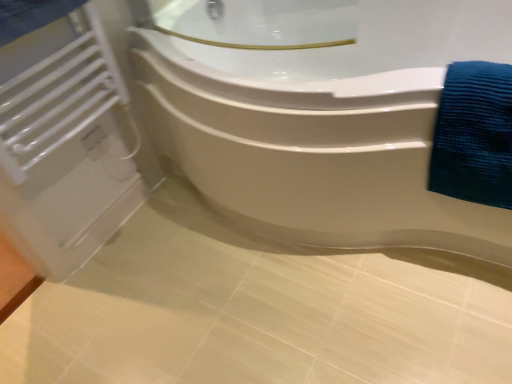
Question: Is white glossy bathtub at upper center looking in the opposite direction of white matte radiator at left?

Choices:
 (A) no
 (B) yes

Answer: (A)

Question: Considering the relative sizes of white glossy bathtub at upper center and white matte radiator at left in the image provided, is white glossy bathtub at upper center bigger than white matte radiator at left?

Choices:
 (A) no
 (B) yes

Answer: (B)

Question: Can you confirm if white glossy bathtub at upper center is thinner than white matte radiator at left?

Choices:
 (A) no
 (B) yes

Answer: (A)

Question: Does white glossy bathtub at upper center have a lesser height compared to white matte radiator at left?

Choices:
 (A) no
 (B) yes

Answer: (A)

Question: From the image's perspective, is white glossy bathtub at upper center located above white matte radiator at left?

Choices:
 (A) yes
 (B) no

Answer: (B)

Question: Relative to blue textured towel at right, is white matte radiator at left in front or behind?

Choices:
 (A) behind
 (B) front

Answer: (A)

Question: In terms of height, does white matte radiator at left look taller or shorter compared to blue textured towel at right?

Choices:
 (A) short
 (B) tall

Answer: (B)

Question: From the image's perspective, is white matte radiator at left located above or below blue textured towel at right?

Choices:
 (A) below
 (B) above

Answer: (B)

Question: Is point (57, 57) closer or farther from the camera than point (485, 139)?

Choices:
 (A) farther
 (B) closer

Answer: (A)

Question: From the image's perspective, is blue textured towel at right above or below white matte radiator at left?

Choices:
 (A) below
 (B) above

Answer: (A)

Question: Considering the positions of blue textured towel at right and white matte radiator at left in the image, is blue textured towel at right taller or shorter than white matte radiator at left?

Choices:
 (A) tall
 (B) short

Answer: (B)

Question: From a real-world perspective, is blue textured towel at right above or below white matte radiator at left?

Choices:
 (A) below
 (B) above

Answer: (A)

Question: Is blue textured towel at right to the left or to the right of white matte radiator at left in the image?

Choices:
 (A) left
 (B) right

Answer: (B)

Question: Based on their positions, is white glossy bathtub at upper center located to the left or right of white matte radiator at left?

Choices:
 (A) right
 (B) left

Answer: (A)

Question: From the image's perspective, is white glossy bathtub at upper center above or below white matte radiator at left?

Choices:
 (A) below
 (B) above

Answer: (A)